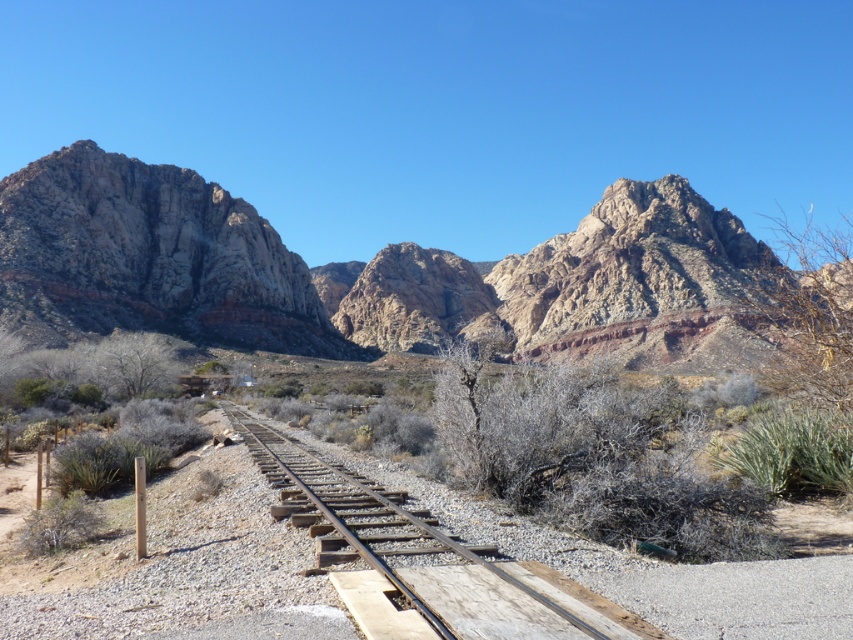
Can you confirm if rugged rock mountain range at upper left is bigger than rusty metal train track at center?

Indeed, rugged rock mountain range at upper left has a larger size compared to rusty metal train track at center.

Is rugged rock mountain range at upper left to the left of rusty metal train track at center from the viewer's perspective?

Incorrect, rugged rock mountain range at upper left is not on the left side of rusty metal train track at center.

Between point (61, 237) and point (328, 548), which one is positioned behind?

Point (61, 237)

Identify the location of rugged rock mountain range at upper left. (349, 269).

Does rugged rock formation at left have a lesser width compared to rusty metal train track at center?

Incorrect, rugged rock formation at left's width is not less than rusty metal train track at center's.

Locate an element on the screen. This screenshot has height=640, width=853. rugged rock formation at left is located at coordinates (148, 257).

Between rugged rock mountain range at upper left and rugged rock formation at left, which one has less height?

rugged rock formation at left

Is point (178, 205) positioned in front of point (141, 257)?

No, it is behind (141, 257).

The height and width of the screenshot is (640, 853). In order to click on rugged rock mountain range at upper left in this screenshot , I will do pos(349,269).